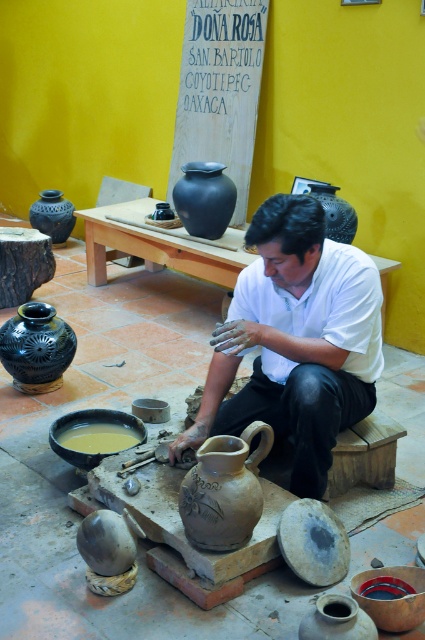
Question: Is matte black vase at left thinner than matte black vase at upper right?

Choices:
 (A) no
 (B) yes

Answer: (A)

Question: Which point is closer to the camera?

Choices:
 (A) matte white shirt at center
 (B) matte black vase at upper right
 (C) black matte vase at left
 (D) matte black vase at center

Answer: (A)

Question: Which object appears farthest from the camera in this image?

Choices:
 (A) matte black vase at center
 (B) matte black vase at left
 (C) black matte vase at left

Answer: (B)

Question: Which point is closer to the camera?

Choices:
 (A) matte white shirt at center
 (B) black matte vase at left
 (C) matte black vase at left
 (D) matte black vase at center

Answer: (A)

Question: Is black matte vase at left thinner than matte black vase at center?

Choices:
 (A) no
 (B) yes

Answer: (B)

Question: Does matte white shirt at center lie in front of matte black vase at upper right?

Choices:
 (A) yes
 (B) no

Answer: (A)